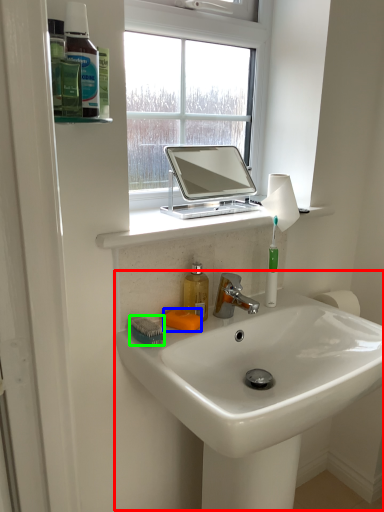
Question: Estimate the real-world distances between objects in this image. Which object is farther from sink (highlighted by a red box), soap (highlighted by a blue box) or brush (highlighted by a green box)?

Choices:
 (A) soap
 (B) brush

Answer: (B)